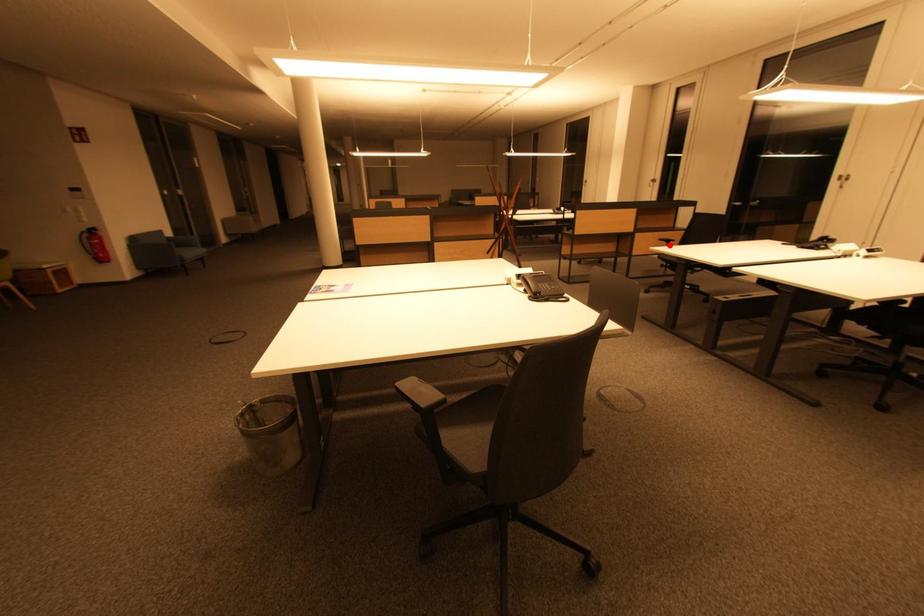
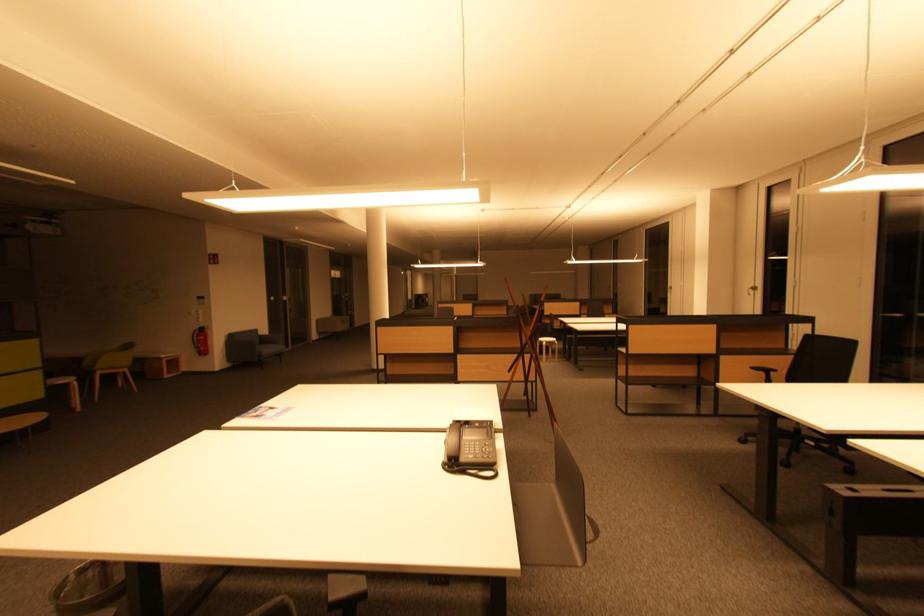
In the second image, find the point that corresponds to the highlighted location in the first image.

(767, 376)